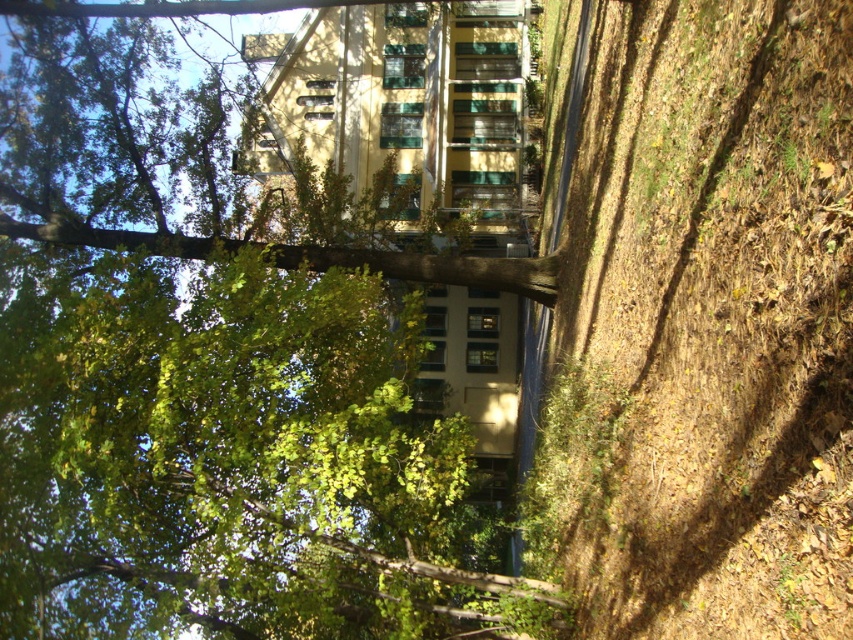
Based on the photo, you are standing on the pathway in front of the building and want to walk towards the point marked at coordinates point(409, 470) and point(718, 595). Which point will you reach first?

You will reach point(409, 470) first because it is closer to you than point(718, 595), which is further away.

You are standing on the pathway and want to walk towards the brown dirt at lower right. Which direction should you move relative to the green leafy tree at center?

To reach the brown dirt at lower right, you should move behind the green leafy tree at center since the brown dirt at lower right is located behind it.